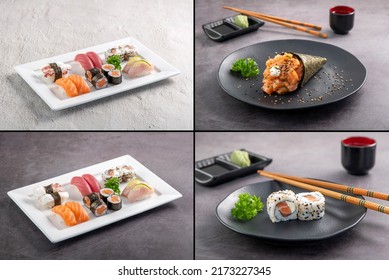
The height and width of the screenshot is (280, 389). What are the coordinates of `black plate` in the screenshot? It's located at (288, 235).